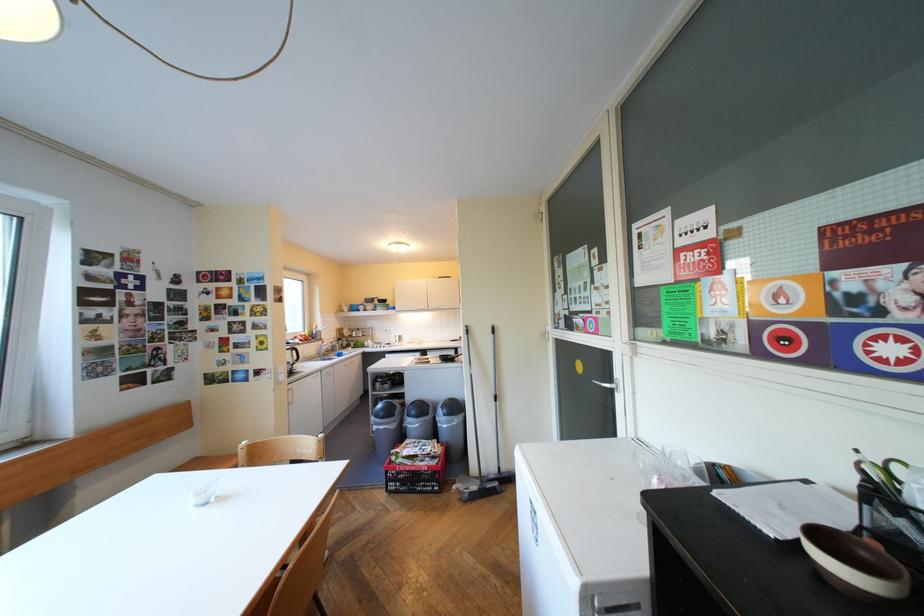
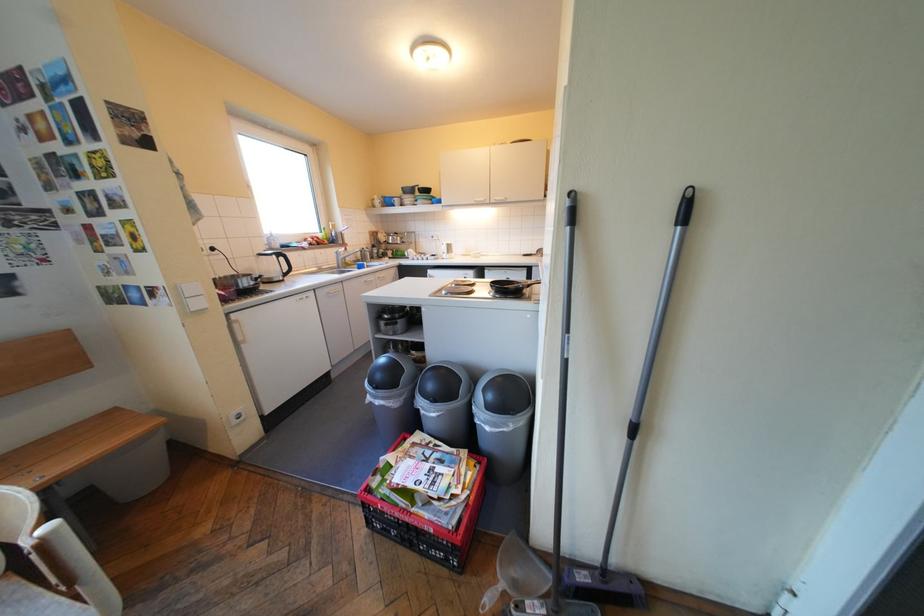
Question: What movement of the cameraman would produce the second image?

Choices:
 (A) Left
 (B) Right
 (C) Forward
 (D) Backward

Answer: (C)